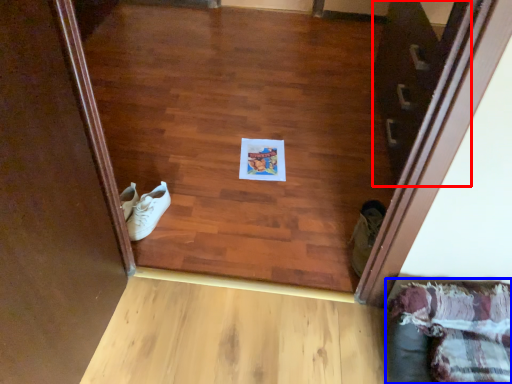
Question: Among these objects, which one is farthest to the camera, stairwell (highlighted by a red box) or couch (highlighted by a blue box)?

Choices:
 (A) stairwell
 (B) couch

Answer: (A)